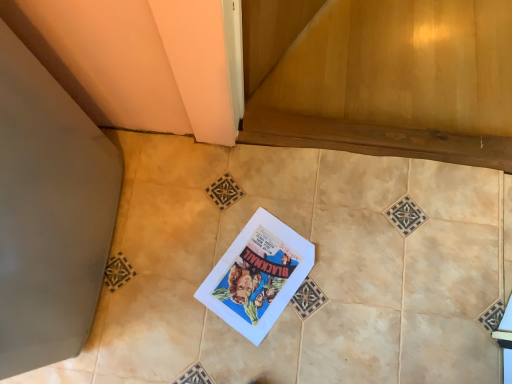
Question: Considering the relative positions of wooden at lower center and beige ceramic tile at center in the image provided, is wooden at lower center in front of beige ceramic tile at center?

Choices:
 (A) no
 (B) yes

Answer: (A)

Question: Can you see wooden at lower center touching beige ceramic tile at center?

Choices:
 (A) yes
 (B) no

Answer: (B)

Question: Is wooden at lower center outside beige ceramic tile at center?

Choices:
 (A) yes
 (B) no

Answer: (A)

Question: Does wooden at lower center come behind beige ceramic tile at center?

Choices:
 (A) yes
 (B) no

Answer: (A)

Question: Does wooden at lower center have a larger size compared to beige ceramic tile at center?

Choices:
 (A) no
 (B) yes

Answer: (A)

Question: In terms of width, does matte paper comic book at center look wider or thinner when compared to beige ceramic tile at center?

Choices:
 (A) thin
 (B) wide

Answer: (A)

Question: Considering their positions, is matte paper comic book at center located in front of or behind beige ceramic tile at center?

Choices:
 (A) front
 (B) behind

Answer: (B)

Question: From a real-world perspective, is matte paper comic book at center physically located above or below beige ceramic tile at center?

Choices:
 (A) below
 (B) above

Answer: (A)

Question: Do you think matte paper comic book at center is within beige ceramic tile at center, or outside of it?

Choices:
 (A) inside
 (B) outside

Answer: (A)

Question: From the image's perspective, relative to wooden at lower center, is beige ceramic tile at center above or below?

Choices:
 (A) below
 (B) above

Answer: (A)

Question: Considering the positions of beige ceramic tile at center and wooden at lower center in the image, is beige ceramic tile at center taller or shorter than wooden at lower center?

Choices:
 (A) tall
 (B) short

Answer: (B)

Question: In the image, is beige ceramic tile at center on the left side or the right side of wooden at lower center?

Choices:
 (A) right
 (B) left

Answer: (B)

Question: Considering the positions of beige ceramic tile at center and wooden at lower center in the image, is beige ceramic tile at center wider or thinner than wooden at lower center?

Choices:
 (A) wide
 (B) thin

Answer: (A)

Question: From a real-world perspective, is wooden at lower center positioned above or below matte paper comic book at center?

Choices:
 (A) above
 (B) below

Answer: (A)

Question: Relative to matte paper comic book at center, is wooden at lower center in front or behind?

Choices:
 (A) behind
 (B) front

Answer: (A)